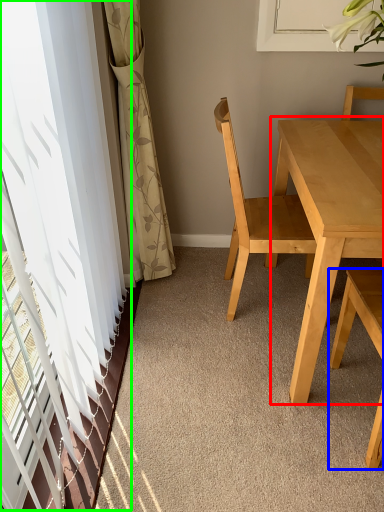
Question: Based on their relative distances, which object is farther from kitchen & dining room table (highlighted by a red box)? Choose from chair (highlighted by a blue box) and window (highlighted by a green box).

Choices:
 (A) chair
 (B) window

Answer: (B)